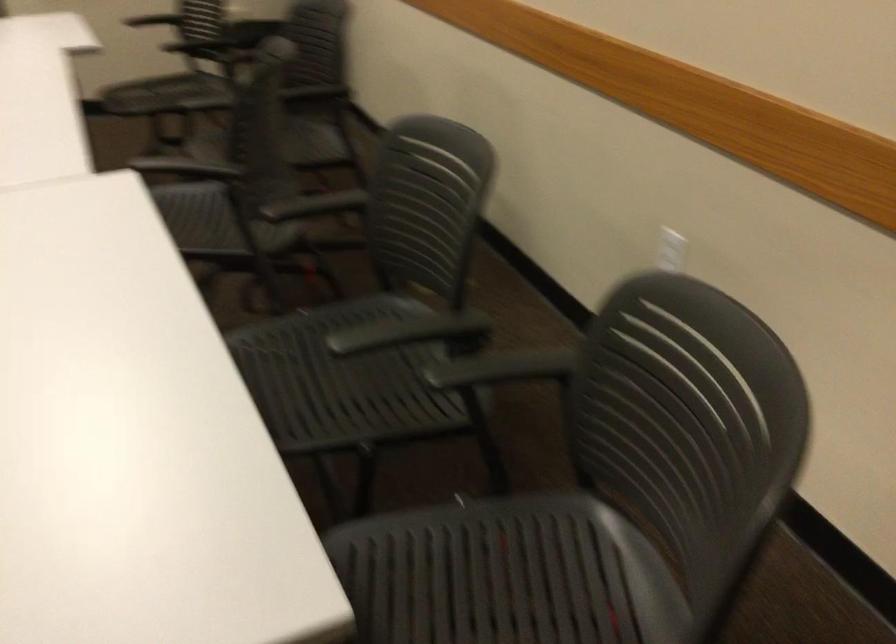
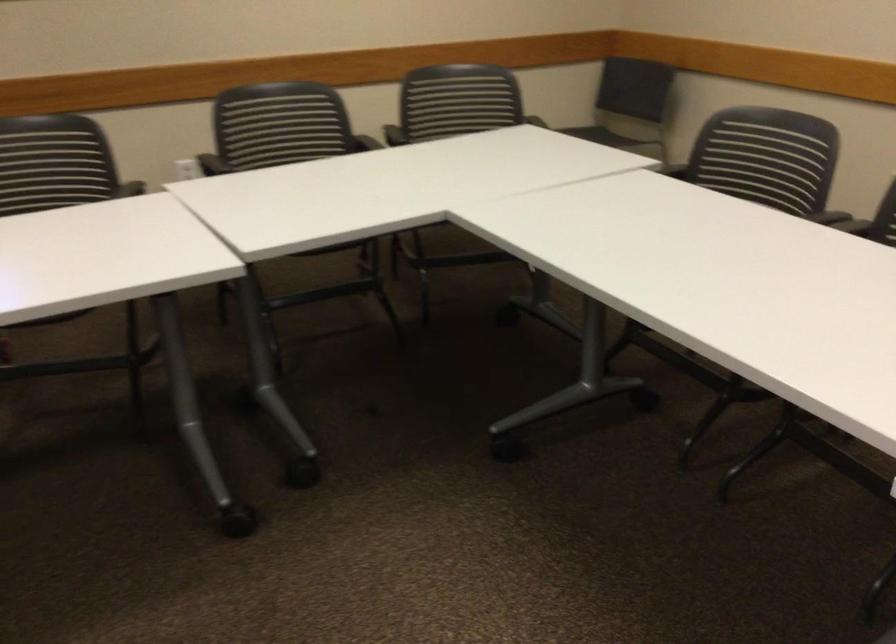
The point at (469, 337) is marked in the first image. Where is the corresponding point in the second image?

(360, 142)